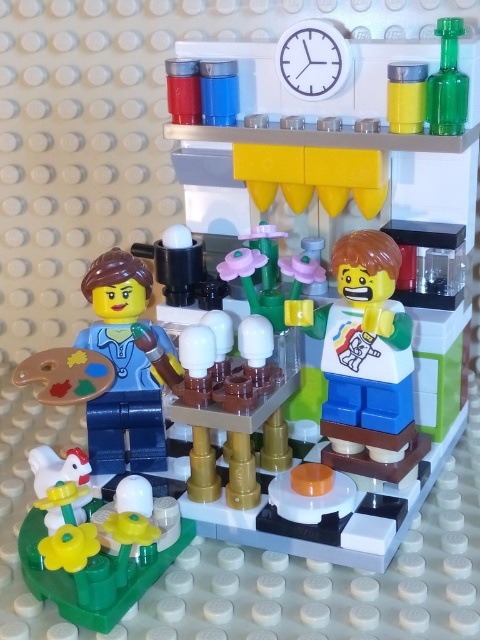
Who is more forward, (145, 280) or (452, 106)?

Point (452, 106) is in front.

Who is more distant from viewer, [108,284] or [450,84]?

Positioned behind is point [108,284].

The height and width of the screenshot is (640, 480). I want to click on matte blue figure at left, so point(121,369).

Consider the image. Which is more to the right, smooth white plate at center or green translucent plastic bottle at upper right?

Positioned to the right is green translucent plastic bottle at upper right.

Is point (348, 384) positioned before point (447, 61)?

No, it is not.

What are the coordinates of `smooth white plate at center` in the screenshot? It's located at (365, 362).

In the scene shown: Is yellow matte flower at lower left below green translucent plastic bottle at upper right?

Yes.

Does yellow matte flower at lower left have a larger size compared to green translucent plastic bottle at upper right?

Yes, yellow matte flower at lower left is bigger than green translucent plastic bottle at upper right.

In order to click on yellow matte flower at lower left in this screenshot , I will do `click(94, 544)`.